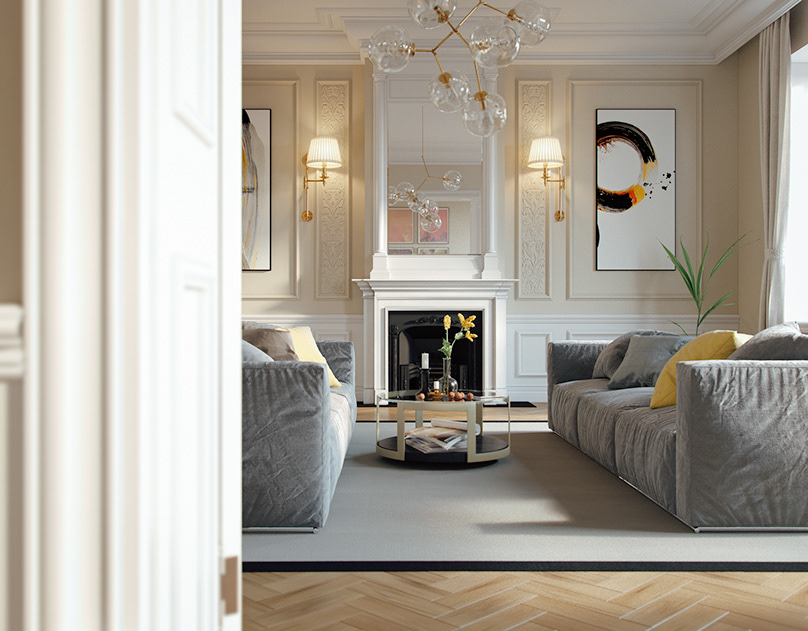
This screenshot has height=631, width=808. Identify the location of fireplace. (439, 346).